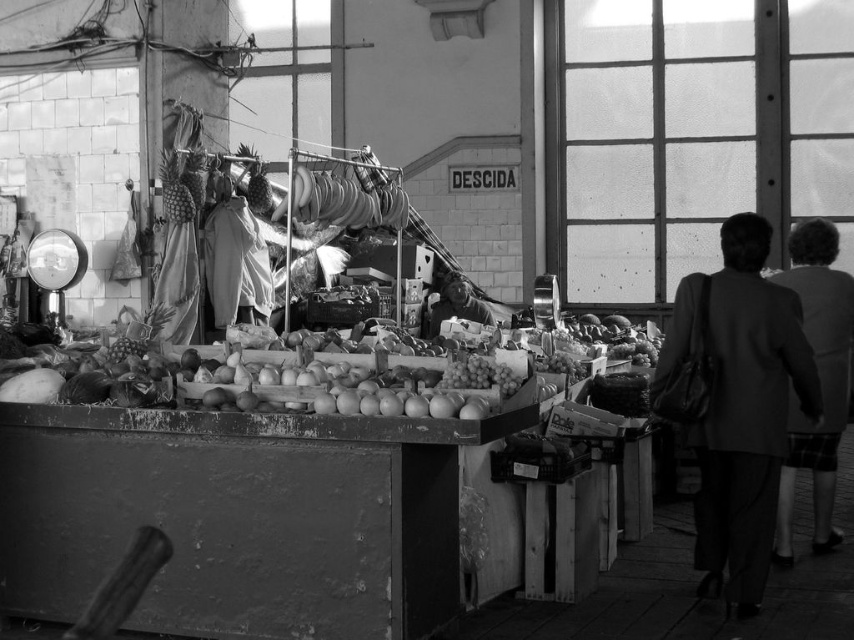
Question: Among these points, which one is farthest from the camera?

Choices:
 (A) (94, 355)
 (B) (449, 285)
 (C) (693, 436)
 (D) (791, 433)

Answer: (B)

Question: Is plaid skirt at right bigger than smooth skin face at center?

Choices:
 (A) yes
 (B) no

Answer: (A)

Question: Among these objects, which one is nearest to the camera?

Choices:
 (A) smooth wooden crate at center
 (B) dark gray suit at right
 (C) plaid skirt at right
 (D) smooth skin face at center

Answer: (A)

Question: Which object is the closest to the dark gray suit at right?

Choices:
 (A) smooth skin face at center
 (B) smooth wooden crate at center

Answer: (B)

Question: Considering the relative positions of smooth wooden crate at center and plaid skirt at right in the image provided, where is smooth wooden crate at center located with respect to plaid skirt at right?

Choices:
 (A) left
 (B) right

Answer: (A)

Question: Is plaid skirt at right thinner than smooth skin face at center?

Choices:
 (A) yes
 (B) no

Answer: (A)